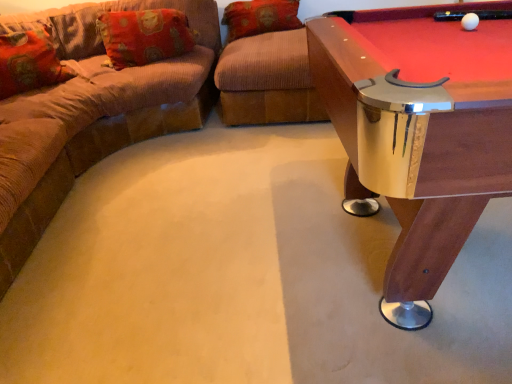
Question: From the image's perspective, would you say wooden pool table at right is shown under brown corduroy ottoman at center?

Choices:
 (A) no
 (B) yes

Answer: (B)

Question: From the image's perspective, is wooden pool table at right above brown corduroy ottoman at center?

Choices:
 (A) no
 (B) yes

Answer: (A)

Question: Is wooden pool table at right further to camera compared to brown corduroy ottoman at center?

Choices:
 (A) yes
 (B) no

Answer: (B)

Question: Is wooden pool table at right not within brown corduroy ottoman at center?

Choices:
 (A) no
 (B) yes

Answer: (B)

Question: Does wooden pool table at right appear on the right side of brown corduroy ottoman at center?

Choices:
 (A) no
 (B) yes

Answer: (B)

Question: Can you confirm if wooden pool table at right is thinner than brown corduroy ottoman at center?

Choices:
 (A) yes
 (B) no

Answer: (A)

Question: From the image's perspective, does wooden pool table at right appear higher than orange corduroy pillow at upper center, the 1th pillow when ordered from right to left?

Choices:
 (A) no
 (B) yes

Answer: (A)

Question: From a real-world perspective, is wooden pool table at right on top of orange corduroy pillow at upper center, positioned as the 3th pillow in left-to-right order?

Choices:
 (A) yes
 (B) no

Answer: (B)

Question: Considering the relative sizes of wooden pool table at right and orange corduroy pillow at upper center, the 1th pillow when ordered from right to left, in the image provided, is wooden pool table at right shorter than orange corduroy pillow at upper center, the 1th pillow when ordered from right to left,?

Choices:
 (A) yes
 (B) no

Answer: (B)

Question: Is wooden pool table at right with orange corduroy pillow at upper center, the 1th pillow when ordered from right to left?

Choices:
 (A) yes
 (B) no

Answer: (B)

Question: Can you confirm if wooden pool table at right is wider than orange corduroy pillow at upper center, positioned as the 3th pillow in left-to-right order?

Choices:
 (A) yes
 (B) no

Answer: (A)

Question: Considering the relative positions of wooden pool table at right and orange corduroy pillow at upper center, positioned as the 3th pillow in left-to-right order, in the image provided, is wooden pool table at right to the right of orange corduroy pillow at upper center, positioned as the 3th pillow in left-to-right order, from the viewer's perspective?

Choices:
 (A) no
 (B) yes

Answer: (B)

Question: From the image's perspective, is orange fabric pillow at upper left, acting as the second pillow starting from the left, located above brown corduroy couch at left?

Choices:
 (A) no
 (B) yes

Answer: (B)